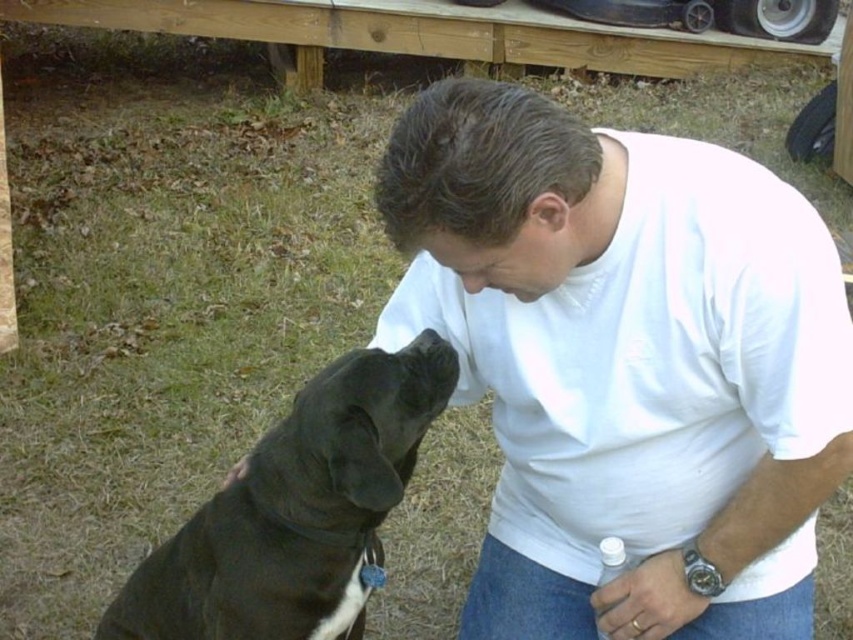
The black smooth dog at lower left is located at which coordinate point?

The black smooth dog at lower left is located at point [297,512].

You are a photographer trying to capture a closeup of the metallic silver watch at lower right and the black matte nose at center. Since you want both objects to appear clearly in the photo, which object should you focus on to ensure the larger one is in sharp focus?

The metallic silver watch at lower right is larger than the black matte nose at center, so you should focus on the metallic silver watch at lower right to ensure it is in sharp focus.

You are a photographer trying to capture the man and his dog in the scene. You notice the white cotton shirt at center and the metallic silver watch at lower right. Which object should you focus on first if you want to ensure both are in sharp focus?

You should focus on the white cotton shirt at center first because it is closer to the viewer than the metallic silver watch at lower right. By focusing on the closer object, the watch will also be in focus due to the depth of field.